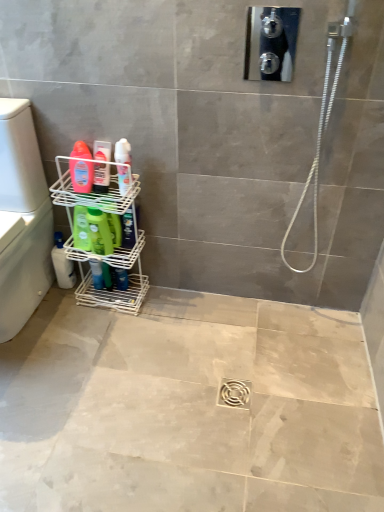
Question: Would you say white plastic washer at left is a long distance from matte pink bottle at left, which ranks as the second cleaning product in left-to-right order?

Choices:
 (A) no
 (B) yes

Answer: (A)

Question: Is white plastic washer at left positioned behind matte pink bottle at left, which ranks as the 1th cleaning product in front-to-back order?

Choices:
 (A) no
 (B) yes

Answer: (A)

Question: Considering the relative sizes of white plastic washer at left and matte pink bottle at left, which ranks as the 1th cleaning product in front-to-back order, in the image provided, is white plastic washer at left smaller than matte pink bottle at left, which ranks as the 1th cleaning product in front-to-back order,?

Choices:
 (A) no
 (B) yes

Answer: (A)

Question: Considering the relative sizes of white plastic washer at left and matte pink bottle at left, which appears as the 3th cleaning product when ordered from the bottom, in the image provided, is white plastic washer at left taller than matte pink bottle at left, which appears as the 3th cleaning product when ordered from the bottom,?

Choices:
 (A) no
 (B) yes

Answer: (B)

Question: Is white plastic washer at left bigger than matte pink bottle at left, which ranks as the 1th cleaning product in front-to-back order?

Choices:
 (A) yes
 (B) no

Answer: (A)

Question: Do you think white wire shelf at lower left is within white glossy spray can at upper center, marked as the first toiletry in a right-to-left arrangement, or outside of it?

Choices:
 (A) outside
 (B) inside

Answer: (A)

Question: Relative to white glossy spray can at upper center, marked as the first toiletry in a right-to-left arrangement, is white wire shelf at lower left in front or behind?

Choices:
 (A) behind
 (B) front

Answer: (B)

Question: From a real-world perspective, is white wire shelf at lower left positioned above or below white glossy spray can at upper center, which appears as the 2th toiletry when viewed from the left?

Choices:
 (A) above
 (B) below

Answer: (B)

Question: From the image's perspective, relative to white glossy spray can at upper center, marked as the first toiletry in a right-to-left arrangement, is white wire shelf at lower left above or below?

Choices:
 (A) below
 (B) above

Answer: (A)

Question: Is point (21, 114) positioned closer to the camera than point (314, 250)?

Choices:
 (A) closer
 (B) farther

Answer: (A)

Question: Is white plastic washer at left bigger or smaller than silver metallic hose at upper right?

Choices:
 (A) big
 (B) small

Answer: (A)

Question: Looking at their shapes, would you say white plastic washer at left is wider or thinner than silver metallic hose at upper right?

Choices:
 (A) wide
 (B) thin

Answer: (A)

Question: Considering the relative positions of white plastic washer at left and silver metallic hose at upper right in the image provided, is white plastic washer at left to the left or to the right of silver metallic hose at upper right?

Choices:
 (A) left
 (B) right

Answer: (A)

Question: In terms of height, does translucent plastic bottle at left, the first toiletry from the left, look taller or shorter compared to green matte bottle at lower left, arranged as the second cleaning product when viewed from the front?

Choices:
 (A) short
 (B) tall

Answer: (A)

Question: From a real-world perspective, is translucent plastic bottle at left, arranged as the second toiletry when viewed from the right, above or below green matte bottle at lower left, which ranks as the 2th cleaning product in back-to-front order?

Choices:
 (A) below
 (B) above

Answer: (B)